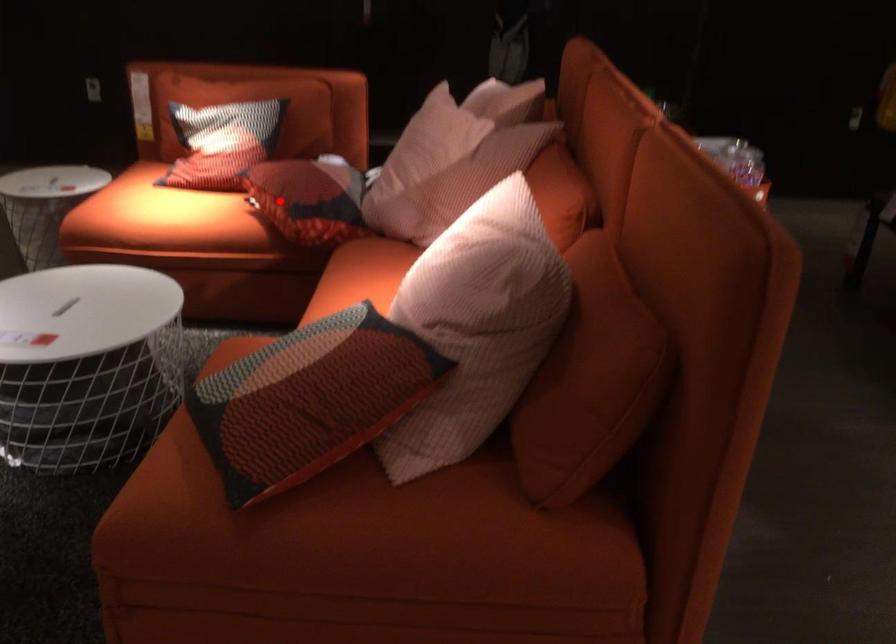
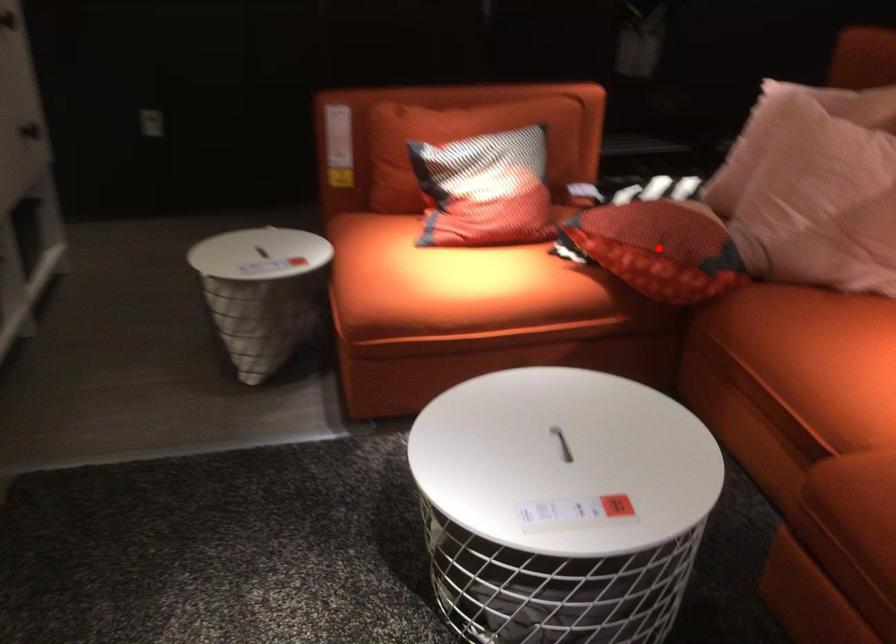
I am providing you with two images of the same scene from different viewpoints. A red point is marked on the first image and another point is marked on the second image. Is the marked point in image1 the same physical position as the marked point in image2?

Yes